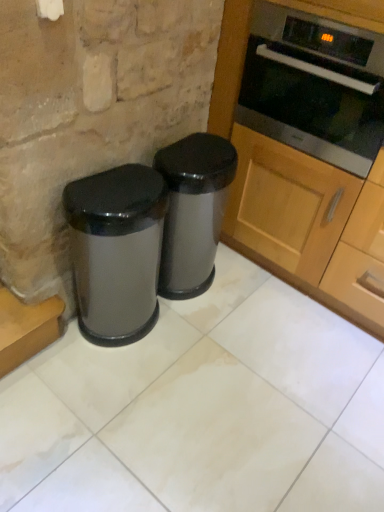
Question: Could you tell me if glossy metallic trash can at lower left, which appears as the 2th waste container when viewed from the right, is facing stainless steel oven at upper right?

Choices:
 (A) yes
 (B) no

Answer: (B)

Question: Is glossy metallic trash can at lower left, marked as the first waste container in a left-to-right arrangement, facing away from stainless steel oven at upper right?

Choices:
 (A) yes
 (B) no

Answer: (B)

Question: From the image's perspective, is glossy metallic trash can at lower left, marked as the first waste container in a left-to-right arrangement, above stainless steel oven at upper right?

Choices:
 (A) no
 (B) yes

Answer: (A)

Question: Is the position of glossy metallic trash can at lower left, which appears as the 2th waste container when viewed from the right, less distant than that of stainless steel oven at upper right?

Choices:
 (A) yes
 (B) no

Answer: (A)

Question: Is glossy metallic trash can at lower left, which appears as the 2th waste container when viewed from the right, shorter than stainless steel oven at upper right?

Choices:
 (A) no
 (B) yes

Answer: (A)

Question: Can you confirm if glossy metallic trash can at lower left, which appears as the 2th waste container when viewed from the right, is thinner than stainless steel oven at upper right?

Choices:
 (A) no
 (B) yes

Answer: (B)

Question: Could you tell me if satin silver trash can at center, the second waste container viewed from the left, is facing wooden cabinet at right?

Choices:
 (A) yes
 (B) no

Answer: (B)

Question: From a real-world perspective, is satin silver trash can at center, the second waste container viewed from the left, positioned over wooden cabinet at right based on gravity?

Choices:
 (A) no
 (B) yes

Answer: (A)

Question: Considering the relative positions of satin silver trash can at center, which is the first waste container in right-to-left order, and wooden cabinet at right in the image provided, is satin silver trash can at center, which is the first waste container in right-to-left order, to the left of wooden cabinet at right from the viewer's perspective?

Choices:
 (A) no
 (B) yes

Answer: (B)

Question: Is the position of satin silver trash can at center, which is the first waste container in right-to-left order, more distant than that of wooden cabinet at right?

Choices:
 (A) yes
 (B) no

Answer: (A)

Question: Is satin silver trash can at center, which is the first waste container in right-to-left order, turned away from wooden cabinet at right?

Choices:
 (A) yes
 (B) no

Answer: (B)

Question: Does satin silver trash can at center, the second waste container viewed from the left, have a larger size compared to wooden cabinet at right?

Choices:
 (A) no
 (B) yes

Answer: (A)

Question: From a real-world perspective, is glossy metallic trash can at lower left, which appears as the 2th waste container when viewed from the right, under wooden cabinet at right?

Choices:
 (A) no
 (B) yes

Answer: (B)